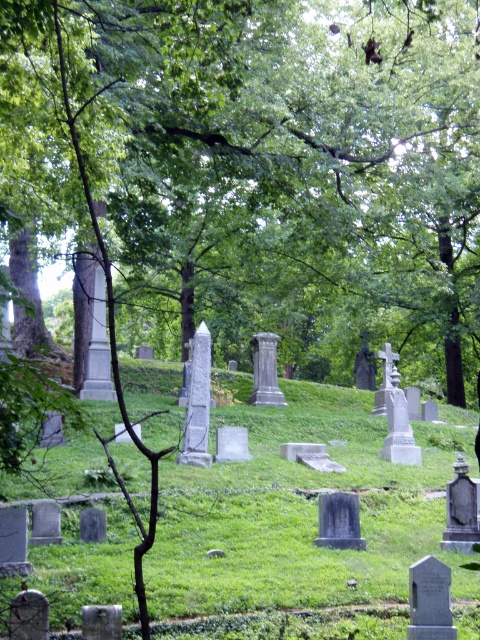
Question: Which object is closer to the camera taking this photo?

Choices:
 (A) green leafy tree at center
 (B) green grassy hillside at center

Answer: (A)

Question: Where is green leafy tree at center located in relation to green grassy hillside at center in the image?

Choices:
 (A) left
 (B) right

Answer: (A)

Question: Does green leafy tree at center have a smaller size compared to green grassy hillside at center?

Choices:
 (A) yes
 (B) no

Answer: (B)

Question: Where is green leafy tree at center located in relation to green grassy hillside at center in the image?

Choices:
 (A) left
 (B) right

Answer: (A)

Question: Which of the following is the farthest from the observer?

Choices:
 (A) green leafy tree at center
 (B) green grassy hillside at center

Answer: (B)

Question: Among these objects, which one is nearest to the camera?

Choices:
 (A) green grassy hillside at center
 (B) green leafy tree at center

Answer: (B)